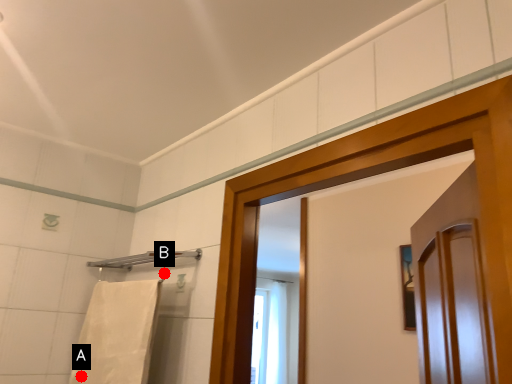
Question: Two points are circled on the image, labeled by A and B beside each circle. Which point is closer to the camera?

Choices:
 (A) A is closer
 (B) B is closer

Answer: (B)